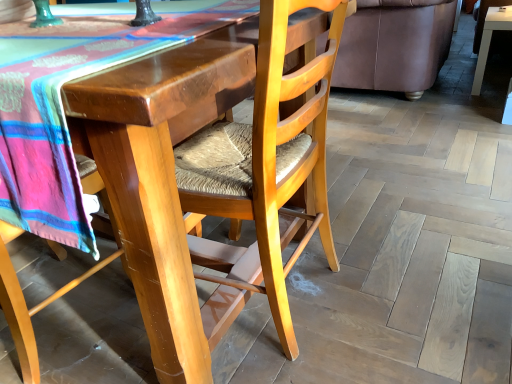
Question: In which direction should I rotate to look at wooden woven seat at center, arranged as the 2th chair when viewed from the right?

Choices:
 (A) right
 (B) left

Answer: (B)

Question: Is wooden woven seat at center, arranged as the 2th chair when viewed from the right, inside brown leather couch at upper right?

Choices:
 (A) no
 (B) yes

Answer: (A)

Question: From a real-world perspective, is brown leather couch at upper right physically below wooden woven seat at center, arranged as the 2th chair when viewed from the right?

Choices:
 (A) yes
 (B) no

Answer: (A)

Question: Is brown leather couch at upper right aimed at wooden woven seat at center, arranged as the 2th chair when viewed from the right?

Choices:
 (A) no
 (B) yes

Answer: (A)

Question: Is the position of brown leather couch at upper right less distant than that of wooden woven seat at center, arranged as the first chair when viewed from the left?

Choices:
 (A) no
 (B) yes

Answer: (A)

Question: Considering the relative sizes of brown leather couch at upper right and wooden woven seat at center, arranged as the first chair when viewed from the left, in the image provided, is brown leather couch at upper right bigger than wooden woven seat at center, arranged as the first chair when viewed from the left,?

Choices:
 (A) yes
 (B) no

Answer: (B)

Question: Does brown leather couch at upper right have a lesser width compared to wooden woven seat at center, arranged as the first chair when viewed from the left?

Choices:
 (A) no
 (B) yes

Answer: (A)

Question: Is brown leather couch at upper right bigger than wooden woven seat at lower left, which appears as the first chair when viewed from the right?

Choices:
 (A) no
 (B) yes

Answer: (B)

Question: Does brown leather couch at upper right have a greater height compared to wooden woven seat at lower left, which ranks as the second chair in left-to-right order?

Choices:
 (A) no
 (B) yes

Answer: (A)

Question: Can you confirm if brown leather couch at upper right is wider than wooden woven seat at lower left, which appears as the first chair when viewed from the right?

Choices:
 (A) no
 (B) yes

Answer: (B)

Question: Would you consider brown leather couch at upper right to be distant from wooden woven seat at lower left, which ranks as the second chair in left-to-right order?

Choices:
 (A) yes
 (B) no

Answer: (A)

Question: Does brown leather couch at upper right appear on the right side of wooden woven seat at lower left, which ranks as the second chair in left-to-right order?

Choices:
 (A) yes
 (B) no

Answer: (A)

Question: Is the depth of brown leather couch at upper right greater than that of wooden woven seat at lower left, which ranks as the second chair in left-to-right order?

Choices:
 (A) no
 (B) yes

Answer: (B)